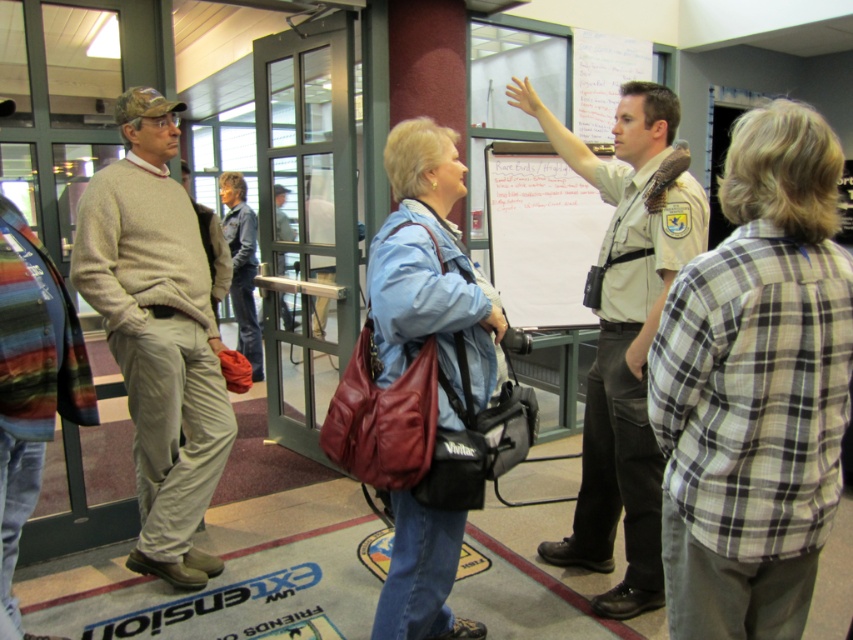
Does striped wool sweater at left have a lesser width compared to light brown leather jacket at center?

Yes, striped wool sweater at left is thinner than light brown leather jacket at center.

Does striped wool sweater at left have a lesser height compared to light brown leather jacket at center?

No, striped wool sweater at left is not shorter than light brown leather jacket at center.

Is point (33, 428) closer to viewer compared to point (279, 232)?

Yes, point (33, 428) is in front of point (279, 232).

Identify the location of striped wool sweater at left. (32, 380).

Who is positioned more to the right, light gray sweater at left or green glass door at center?

green glass door at center is more to the right.

Locate an element on the screen. light gray sweater at left is located at coordinates (157, 333).

The width and height of the screenshot is (853, 640). Describe the element at coordinates (242, 266) in the screenshot. I see `denim jacket at center` at that location.

Can you confirm if denim jacket at center is positioned above light brown leather jacket at center?

Incorrect, denim jacket at center is not positioned above light brown leather jacket at center.

This screenshot has height=640, width=853. What do you see at coordinates (242, 266) in the screenshot? I see `denim jacket at center` at bounding box center [242, 266].

Find the location of a particular element. This screenshot has width=853, height=640. denim jacket at center is located at coordinates (242, 266).